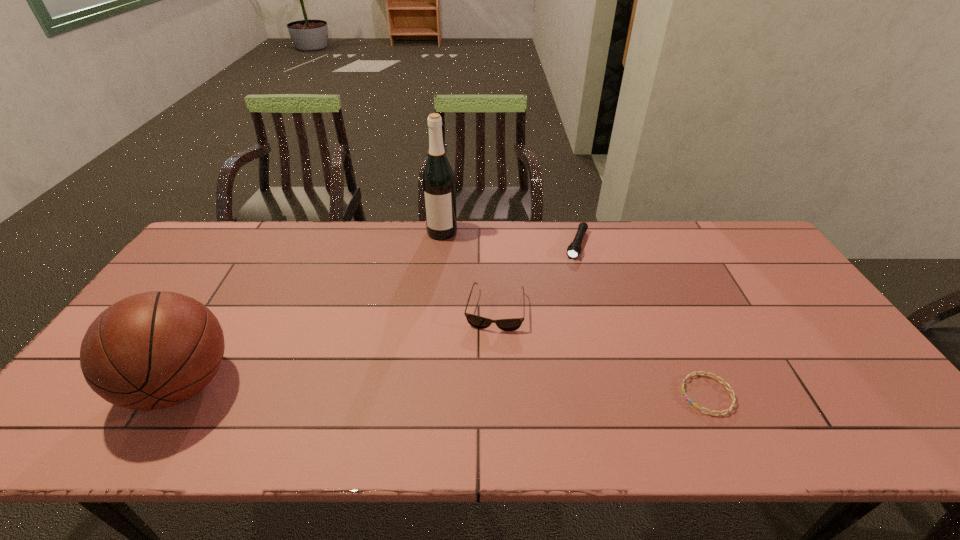
This screenshot has height=540, width=960. Identify the location of vacant space at the right edge of the desktop. pyautogui.click(x=775, y=303).

The width and height of the screenshot is (960, 540). Find the location of `unoccupied position between the fourth shortest object and the wine bottle`. unoccupied position between the fourth shortest object and the wine bottle is located at coordinates (312, 308).

Identify the location of free spot between the third farthest object and the bracelet. The height and width of the screenshot is (540, 960). (601, 352).

This screenshot has width=960, height=540. I want to click on blank region between the sunglasses and the tallest object, so click(468, 271).

Find the location of a particular element. The height and width of the screenshot is (540, 960). free point between the basketball and the bracelet is located at coordinates (444, 390).

Where is `free spot between the wine bottle and the shortest object`? This screenshot has height=540, width=960. free spot between the wine bottle and the shortest object is located at coordinates (575, 313).

Where is `empty space that is in between the third nearest object and the leftmost object`? empty space that is in between the third nearest object and the leftmost object is located at coordinates (339, 347).

At what (x,y) coordinates should I click in order to perform the action: click on vacant region between the tallest object and the fourth object from left to right. Please return your answer as a coordinate pair (x, y). Image resolution: width=960 pixels, height=540 pixels. Looking at the image, I should click on (510, 238).

Identify the location of vacant point located between the fourth object from left to right and the rightmost object. (642, 320).

In order to click on empty location between the shortest object and the sunglasses in this screenshot , I will do `click(601, 352)`.